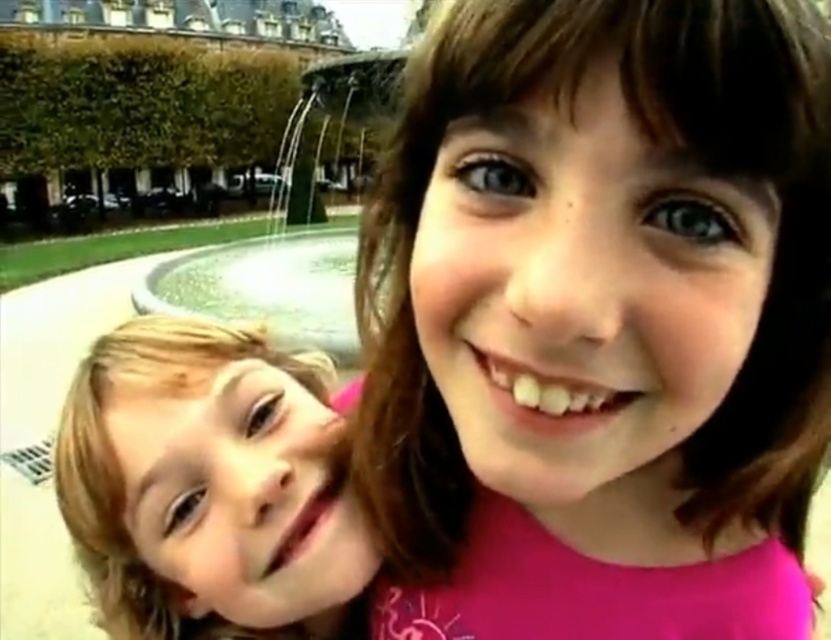
You are a photographer standing at the fountain. You need to take a photo of both the pink fabric at center and the blonde hair at left. The minimum distance between the two objects in the photo should be 10 meters. Can you capture both in one shot?

The pink fabric at center is 12.56 meters from the blonde hair at left. Since the required minimum distance is 10 meters, the photographer can capture both in one shot as the distance meets the requirement.

Based on the photo, you are a photographer trying to capture a photo of the two children in the park. You notice the pink fabric at center and the blonde hair at left. Which object is located to the right of the other?

The pink fabric at center is positioned on the right side of blonde hair at left, so the pink fabric at center is to the right of the blonde hair at left.